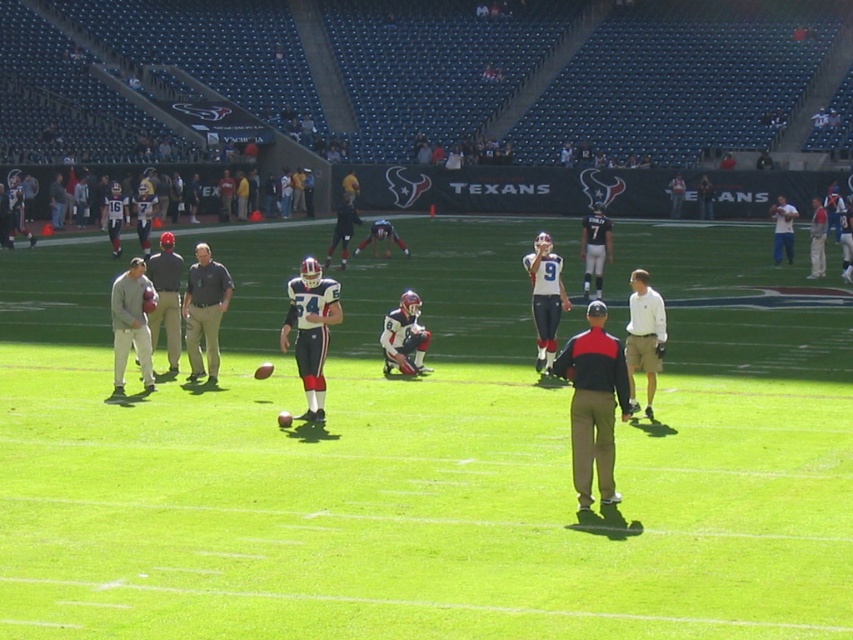
Question: Is gray fabric jacket at center bigger than black jersey at center?

Choices:
 (A) yes
 (B) no

Answer: (B)

Question: Is black fabric pants at center thinner than gray cotton sweatshirt at left?

Choices:
 (A) yes
 (B) no

Answer: (B)

Question: Which point is farther to the camera?

Choices:
 (A) green grass field at center
 (B) white cotton shirt at center

Answer: (B)

Question: Among these points, which one is farthest from the camera?

Choices:
 (A) (149, 330)
 (B) (822, 381)
 (C) (650, 392)
 (D) (589, 216)

Answer: (D)

Question: Which point is farther to the camera?

Choices:
 (A) black jersey at center
 (B) white cotton shirt at center

Answer: (A)

Question: From the image, what is the correct spatial relationship of green grass field at center in relation to black jersey at center?

Choices:
 (A) above
 (B) below

Answer: (B)